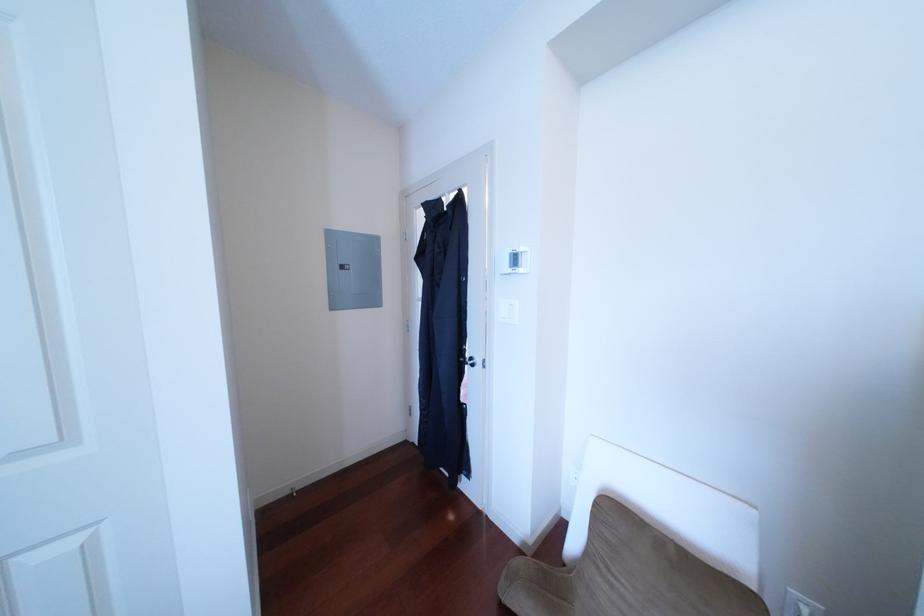
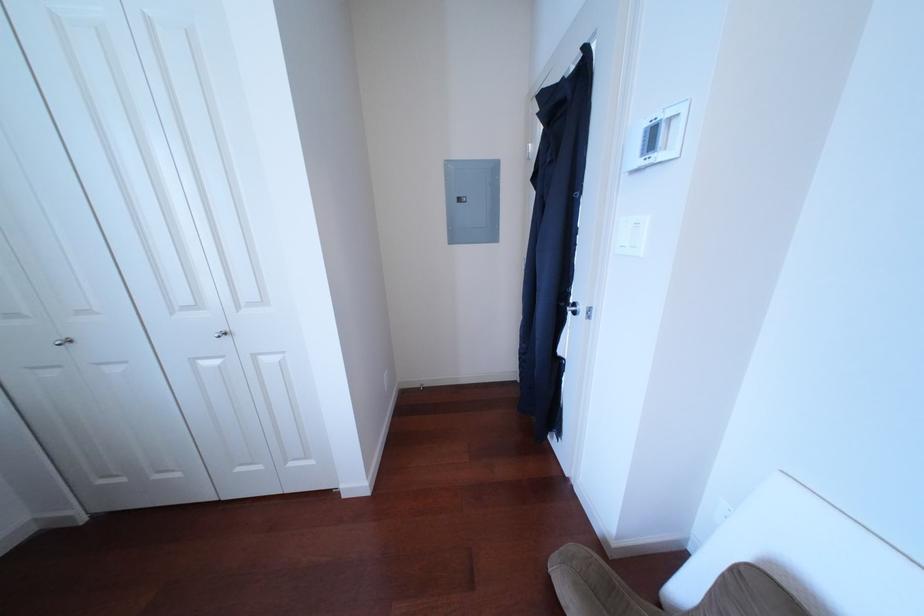
Question: How did the camera likely rotate?

Choices:
 (A) Left
 (B) Right
 (C) Up
 (D) Down

Answer: (A)